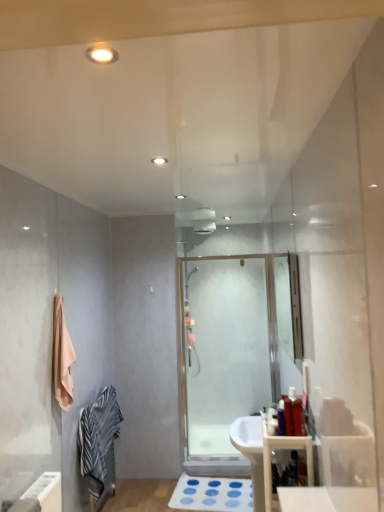
Question: Considering the positions of clear glass mirror at center and striped cotton bathrobe at lower left in the image, is clear glass mirror at center taller or shorter than striped cotton bathrobe at lower left?

Choices:
 (A) tall
 (B) short

Answer: (B)

Question: Is point (288, 354) positioned closer to the camera than point (104, 409)?

Choices:
 (A) farther
 (B) closer

Answer: (A)

Question: Based on their relative distances, which object is farther from the wooden storage at lower right?

Choices:
 (A) white rubber bath mat at lower center
 (B) matte plastic toothbrush at center, arranged as the first toiletry when viewed from the left
 (C) beige cotton towel at left
 (D) transparent glass shower door at center
 (E) striped cotton bathrobe at lower left

Answer: (D)

Question: Considering the real-world distances, which object is closest to the striped cotton bathrobe at lower left?

Choices:
 (A) beige cotton towel at left
 (B) transparent glass shower door at center
 (C) matte plastic bottle at right, arranged as the 2th toiletry when viewed from the left
 (D) wooden storage at lower right
 (E) clear glass mirror at center

Answer: (A)